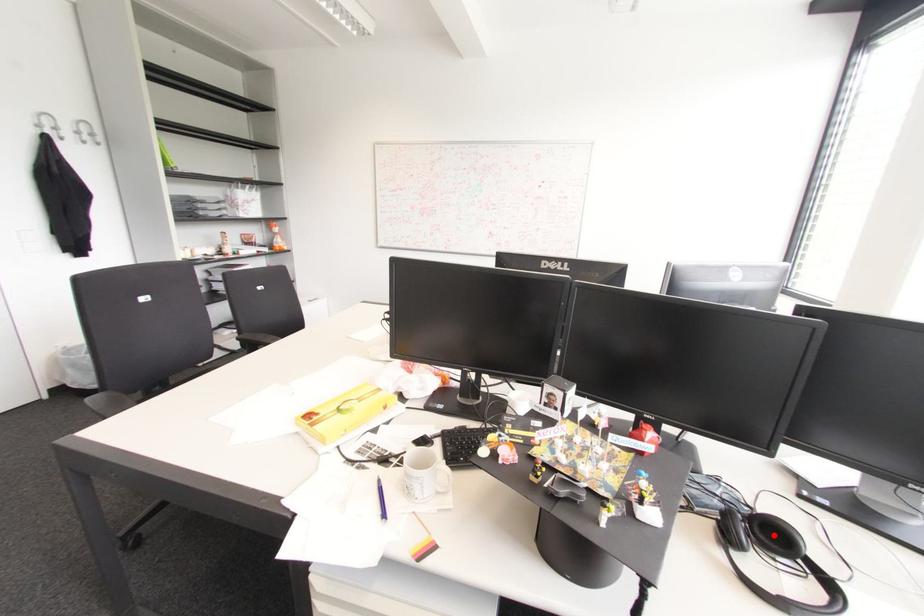
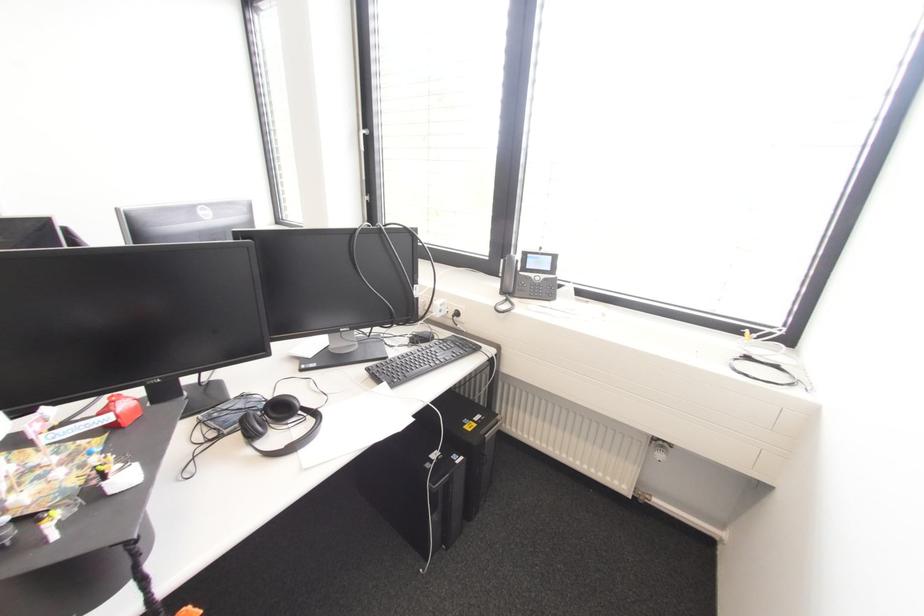
Find the pixel in the second image that matches the highlighted location in the first image.

(281, 408)